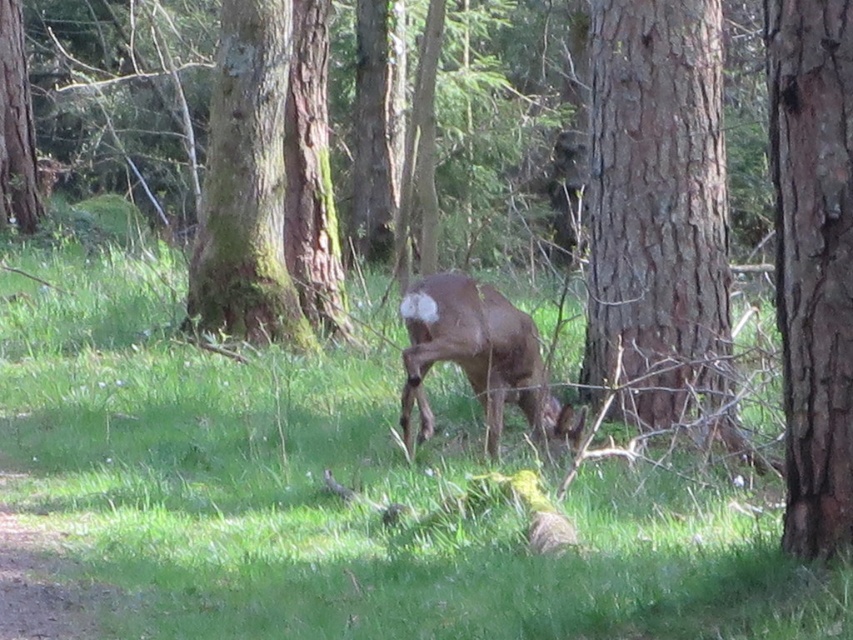
Question: Which object appears closest to the camera in this image?

Choices:
 (A) smooth brown tree trunk at center
 (B) green mossy tree trunk at upper left
 (C) green mossy tree trunk at center
 (D) brown matte/deer at center

Answer: (D)

Question: Which is nearer to the brown matte/deer at center?

Choices:
 (A) green grassy at center
 (B) green mossy tree trunk at center
 (C) smooth brown tree trunk at center
 (D) green mossy tree trunk at upper left

Answer: (C)

Question: Does smooth brown tree trunk at center appear over brown matte/deer at center?

Choices:
 (A) no
 (B) yes

Answer: (B)

Question: Does smooth brown tree trunk at right appear on the right side of green mossy tree trunk at upper left?

Choices:
 (A) yes
 (B) no

Answer: (A)

Question: Is green grassy at center to the left of smooth brown tree trunk at center from the viewer's perspective?

Choices:
 (A) no
 (B) yes

Answer: (B)

Question: Which object is the closest to the green mossy tree trunk at upper left?

Choices:
 (A) smooth brown tree trunk at right
 (B) smooth brown tree trunk at center
 (C) green mossy tree trunk at center
 (D) green grassy at center

Answer: (D)